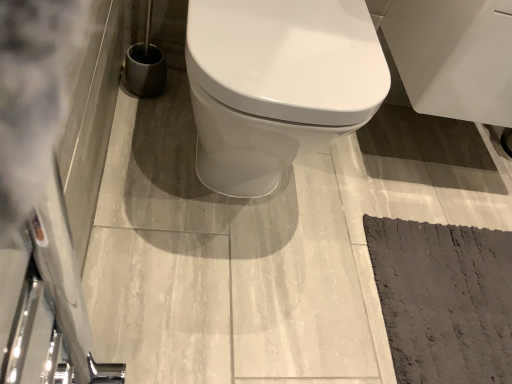
Question: Is white glossy cabinet at upper right positioned with its back to dark gray textured mat at lower right?

Choices:
 (A) yes
 (B) no

Answer: (B)

Question: Is white glossy cabinet at upper right next to dark gray textured mat at lower right and touching it?

Choices:
 (A) no
 (B) yes

Answer: (A)

Question: Considering the relative positions of white glossy cabinet at upper right and dark gray textured mat at lower right in the image provided, is white glossy cabinet at upper right in front of dark gray textured mat at lower right?

Choices:
 (A) yes
 (B) no

Answer: (A)

Question: Is white glossy cabinet at upper right to the left of dark gray textured mat at lower right from the viewer's perspective?

Choices:
 (A) no
 (B) yes

Answer: (A)

Question: Is white glossy cabinet at upper right surrounding dark gray textured mat at lower right?

Choices:
 (A) yes
 (B) no

Answer: (B)

Question: Could you tell me if white glossy cabinet at upper right is facing dark gray textured mat at lower right?

Choices:
 (A) no
 (B) yes

Answer: (A)

Question: From the image's perspective, does dark gray textured mat at lower right appear higher than white glossy cabinet at upper right?

Choices:
 (A) no
 (B) yes

Answer: (A)

Question: Is dark gray textured mat at lower right completely or partially outside of white glossy cabinet at upper right?

Choices:
 (A) no
 (B) yes

Answer: (B)

Question: From a real-world perspective, is dark gray textured mat at lower right located higher than white glossy cabinet at upper right?

Choices:
 (A) no
 (B) yes

Answer: (A)

Question: Is dark gray textured mat at lower right turned away from white glossy cabinet at upper right?

Choices:
 (A) yes
 (B) no

Answer: (B)

Question: From the image's perspective, is dark gray textured mat at lower right under white glossy cabinet at upper right?

Choices:
 (A) yes
 (B) no

Answer: (A)

Question: Would you say white glossy cabinet at upper right is part of dark gray textured mat at lower right's contents?

Choices:
 (A) yes
 (B) no

Answer: (B)

Question: Is dark gray textured mat at lower right situated inside white glossy cabinet at upper right or outside?

Choices:
 (A) outside
 (B) inside

Answer: (A)